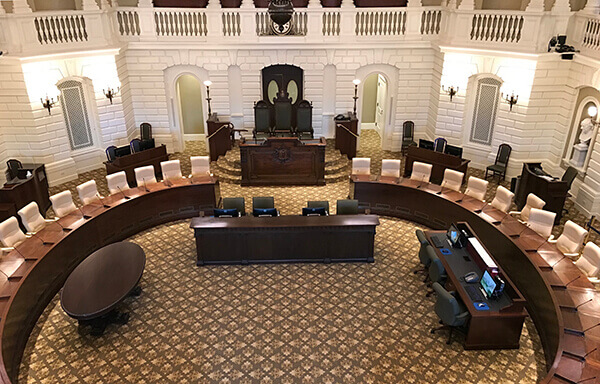
What are the coordinates of `lights` in the screenshot? It's located at (41, 99), (113, 85), (470, 84), (511, 91).